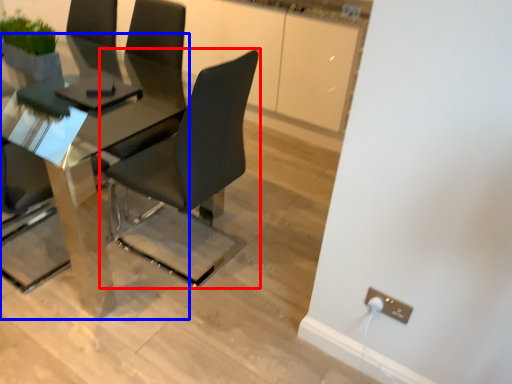
Question: Which of the following is the farthest to the observer, chair (highlighted by a red box) or table (highlighted by a blue box)?

Choices:
 (A) chair
 (B) table

Answer: (B)